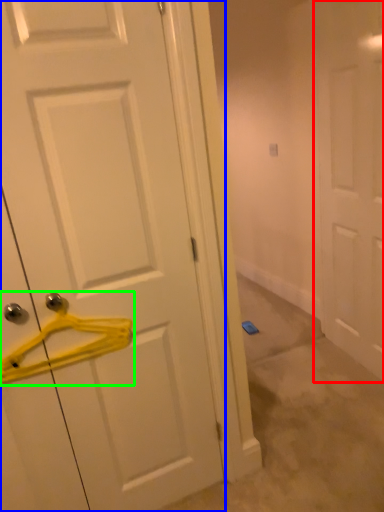
Question: Based on their relative distances, which object is nearer to door (highlighted by a red box)? Choose from door (highlighted by a blue box) and hanger (highlighted by a green box).

Choices:
 (A) door
 (B) hanger

Answer: (A)